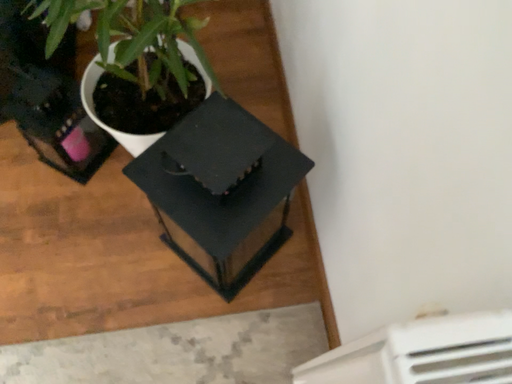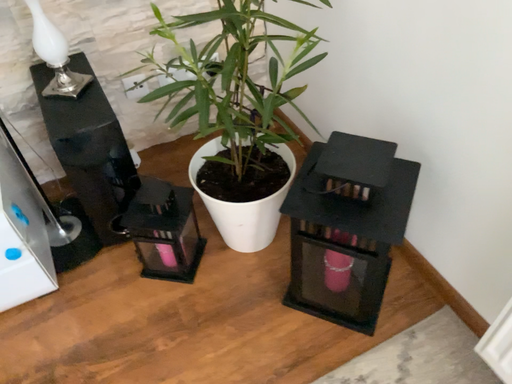
Question: How did the camera likely rotate when shooting the video?

Choices:
 (A) rotated upward
 (B) rotated downward

Answer: (A)